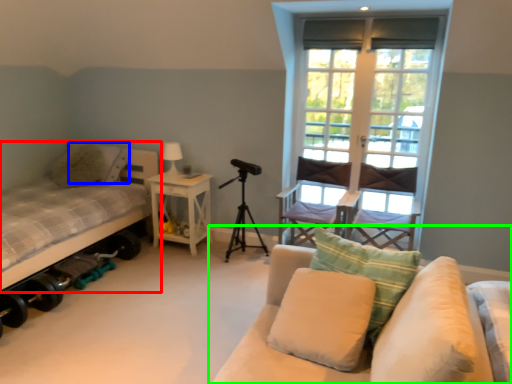
Question: Which object is the closest to the bed (highlighted by a red box)? Choose among these: pillow (highlighted by a blue box) or studio couch (highlighted by a green box).

Choices:
 (A) pillow
 (B) studio couch

Answer: (A)